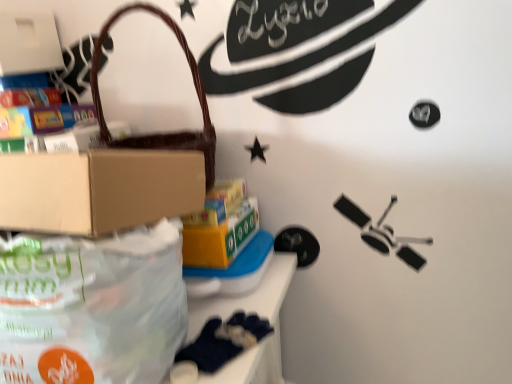
Question: Considering the relative positions of dark blue fabric at lower left and white matte box at upper left, marked as the 1th box in a top-to-bottom arrangement, in the image provided, is dark blue fabric at lower left behind white matte box at upper left, marked as the 1th box in a top-to-bottom arrangement,?

Choices:
 (A) no
 (B) yes

Answer: (A)

Question: Does dark blue fabric at lower left lie in front of white matte box at upper left, the 1th box from the left?

Choices:
 (A) yes
 (B) no

Answer: (A)

Question: From a real-world perspective, is dark blue fabric at lower left on top of white matte box at upper left, the 2th box from the bottom?

Choices:
 (A) yes
 (B) no

Answer: (B)

Question: Can you confirm if dark blue fabric at lower left is taller than white matte box at upper left, the 1th box from the left?

Choices:
 (A) yes
 (B) no

Answer: (B)

Question: Is dark blue fabric at lower left not near white matte box at upper left, which is counted as the second box, starting from the right?

Choices:
 (A) no
 (B) yes

Answer: (A)

Question: In terms of width, does translucent plastic bag at lower left look wider or thinner when compared to brown woven handbag at upper left?

Choices:
 (A) thin
 (B) wide

Answer: (B)

Question: Considering the positions of point (141, 334) and point (203, 104), is point (141, 334) closer or farther from the camera than point (203, 104)?

Choices:
 (A) closer
 (B) farther

Answer: (A)

Question: From the image's perspective, is translucent plastic bag at lower left above or below brown woven handbag at upper left?

Choices:
 (A) below
 (B) above

Answer: (A)

Question: Is translucent plastic bag at lower left taller or shorter than brown woven handbag at upper left?

Choices:
 (A) tall
 (B) short

Answer: (B)

Question: Is yellow cardboard box at center, which is counted as the 1th box, starting from the right, wider or thinner than brown woven handbag at upper left?

Choices:
 (A) thin
 (B) wide

Answer: (B)

Question: From a real-world perspective, is yellow cardboard box at center, placed as the 2th box when sorted from left to right, positioned above or below brown woven handbag at upper left?

Choices:
 (A) below
 (B) above

Answer: (A)

Question: Is yellow cardboard box at center, the first box ordered from the bottom, taller or shorter than brown woven handbag at upper left?

Choices:
 (A) tall
 (B) short

Answer: (B)

Question: Is yellow cardboard box at center, placed as the 2th box when sorted from left to right, situated inside brown woven handbag at upper left or outside?

Choices:
 (A) inside
 (B) outside

Answer: (B)

Question: Is yellow cardboard box at center, the first box ordered from the bottom, situated inside white matte box at upper left, the 1th box from the left, or outside?

Choices:
 (A) outside
 (B) inside

Answer: (A)

Question: Is yellow cardboard box at center, which is counted as the 1th box, starting from the right, in front of or behind white matte box at upper left, the 1th box from the left, in the image?

Choices:
 (A) behind
 (B) front

Answer: (B)